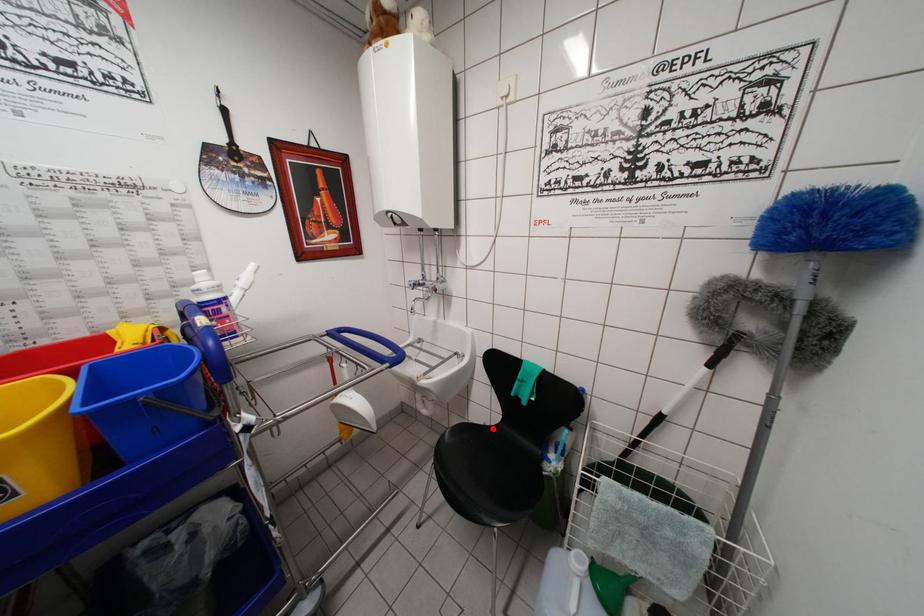
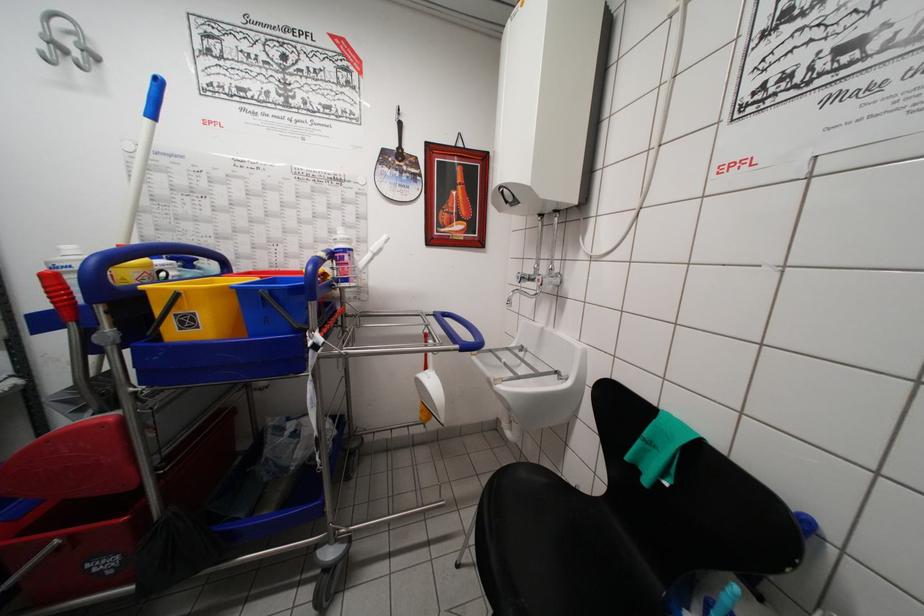
Where in the second image is the point corresponding to the highlighted location from the first image?

(592, 499)